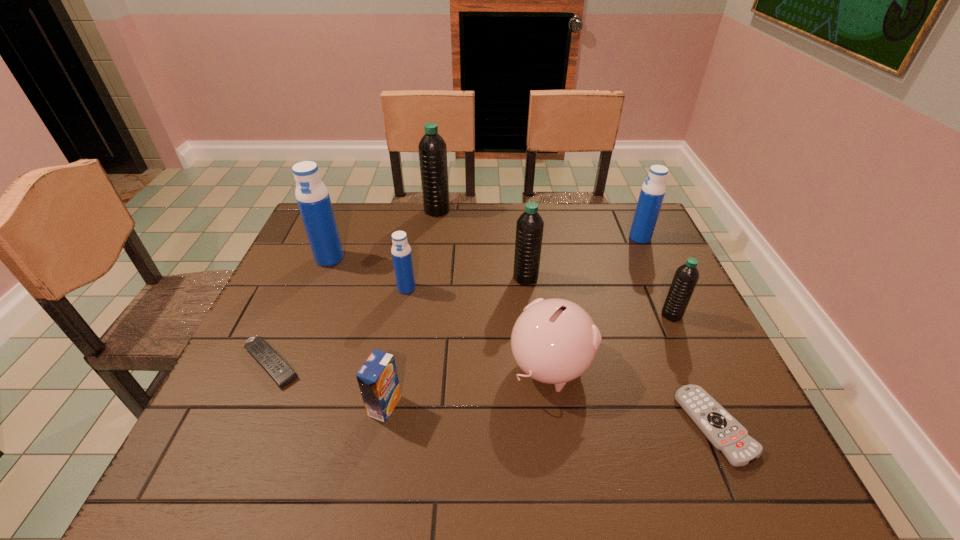
Locate an element on the screen. This screenshot has height=540, width=960. free area in between the third shortest object and the rightmost blue water bottle is located at coordinates (513, 322).

At what (x,y) coordinates should I click in order to perform the action: click on free space between the second biggest black water bottle and the second blue water bottle from right to left. Please return your answer as a coordinate pair (x, y). This screenshot has width=960, height=540. Looking at the image, I should click on (466, 283).

Where is `free area in between the left remote control and the shorter remote control`? free area in between the left remote control and the shorter remote control is located at coordinates (493, 395).

Find the location of a particular element. The image size is (960, 540). vacant space that's between the shortest object and the blue orange_juice is located at coordinates (550, 416).

Where is `empty location between the left remote control and the nearest blue water bottle`? empty location between the left remote control and the nearest blue water bottle is located at coordinates (339, 326).

This screenshot has height=540, width=960. What are the coordinates of `unoccupied position between the second black water bottle from right to left and the left remote control` in the screenshot? It's located at (398, 321).

At what (x,y) coordinates should I click in order to perform the action: click on vacant space in between the second black water bottle from left to right and the left remote control. Please return your answer as a coordinate pair (x, y). The width and height of the screenshot is (960, 540). Looking at the image, I should click on (398, 321).

You are a GUI agent. You are given a task and a screenshot of the screen. Output one action in this format:
    pyautogui.click(x=<x>, y=<y>)
    Task: Click on the object that is the sixth closest to the farthest blue water bottle
    This screenshot has width=960, height=540.
    Given the screenshot: What is the action you would take?
    pyautogui.click(x=401, y=252)

This screenshot has width=960, height=540. What are the coordinates of `object that can be found as the fourth closest to the left remote control` in the screenshot? It's located at (554, 341).

Identify which water bottle is the second nearest to the fourth nearest water bottle. Please provide its 2D coordinates. Your answer should be formatted as a tuple, i.e. [(x, y)], where the tuple contains the x and y coordinates of a point satisfying the conditions above.

[(432, 148)]